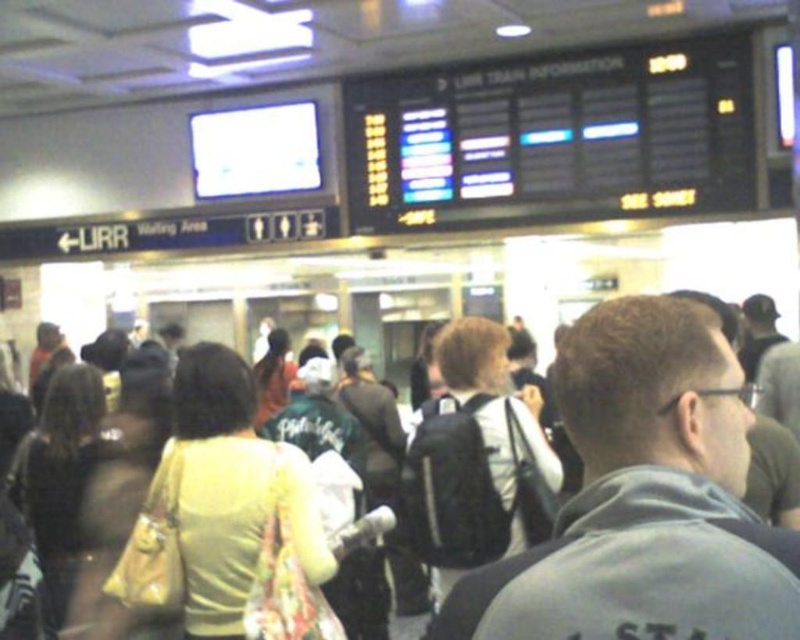
You are a traveler looking for your luggage. You see a black backpack at center and a light beige fabric purse at left. Which item is positioned higher relative to the other?

The black backpack at center is located above the light beige fabric purse at left, so it is positioned higher.

Consider the image. You are a traveler standing in the train station and you see the gray fabric backpack at center and the light beige fabric purse at left. Which item is nearer to you?

The gray fabric backpack at center is closer to the viewer than the light beige fabric purse at left.

You are a traveler at the train station and you have a light yellow fabric purse at center and a black backpack at center. You want to place both items on the platform bench next to you. If the bench is only 1 meter wide, will both items fit side by side?

The light yellow fabric purse at center is wider than the black backpack at center. Since the bench is only 1 meter wide, and the purse alone is wider than the backpack, it depends on the combined width of both items. However, without knowing the exact width of each, we cannot determine if they will fit.